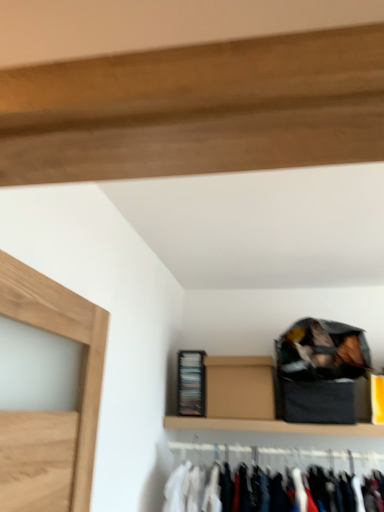
The height and width of the screenshot is (512, 384). In order to click on black plastic cabinet at lower center in this screenshot , I will do `click(191, 383)`.

What is the approximate width of black plastic cabinet at lower center?

It is 10.65 inches.

What do you see at coordinates (191, 383) in the screenshot?
I see `black plastic cabinet at lower center` at bounding box center [191, 383].

The width and height of the screenshot is (384, 512). Find the location of `brown cardboard box at upper center`. brown cardboard box at upper center is located at coordinates (239, 387).

The width and height of the screenshot is (384, 512). Describe the element at coordinates (239, 387) in the screenshot. I see `brown cardboard box at upper center` at that location.

Find the location of a particular element. black plastic cabinet at lower center is located at coordinates (191, 383).

Is brown cardboard box at upper center to the right of black plastic cabinet at lower center from the viewer's perspective?

Indeed, brown cardboard box at upper center is positioned on the right side of black plastic cabinet at lower center.

Looking at this image, is brown cardboard box at upper center positioned before black plastic cabinet at lower center?

Yes, brown cardboard box at upper center is in front of black plastic cabinet at lower center.

Between point (221, 358) and point (191, 358), which one is positioned in front?

Point (221, 358)

From the image's perspective, between brown cardboard box at upper center and black plastic cabinet at lower center, which one is located above?

From the image's view, brown cardboard box at upper center is above.

From a real-world perspective, which is physically below, brown cardboard box at upper center or black plastic cabinet at lower center?

In real-world perspective, brown cardboard box at upper center is lower.

Looking at this image, does brown cardboard box at upper center have a lesser width compared to black plastic cabinet at lower center?

In fact, brown cardboard box at upper center might be wider than black plastic cabinet at lower center.

Does brown cardboard box at upper center have a lesser height compared to black plastic cabinet at lower center?

Yes, brown cardboard box at upper center is shorter than black plastic cabinet at lower center.

In terms of size, does brown cardboard box at upper center appear bigger or smaller than black plastic cabinet at lower center?

Considering their sizes, brown cardboard box at upper center takes up more space than black plastic cabinet at lower center.

Does brown cardboard box at upper center contain black plastic cabinet at lower center?

Actually, black plastic cabinet at lower center is outside brown cardboard box at upper center.

Is brown cardboard box at upper center directly adjacent to black plastic cabinet at lower center?

brown cardboard box at upper center is not next to black plastic cabinet at lower center, and they're not touching.

Is brown cardboard box at upper center oriented towards black plastic cabinet at lower center?

No, brown cardboard box at upper center does not turn towards black plastic cabinet at lower center.

Locate an element on the screen. The height and width of the screenshot is (512, 384). cabinet located below the brown cardboard box at upper center (from the image's perspective) is located at coordinates (191, 383).

Does black plastic cabinet at lower center appear on the right side of brown cardboard box at upper center?

In fact, black plastic cabinet at lower center is to the left of brown cardboard box at upper center.

Is black plastic cabinet at lower center closer to the viewer compared to brown cardboard box at upper center?

No, black plastic cabinet at lower center is further to the viewer.

Does point (203, 379) come in front of point (206, 379)?

No, it is not.

From the image's perspective, is black plastic cabinet at lower center under brown cardboard box at upper center?

Yes.

From a real-world perspective, relative to brown cardboard box at upper center, is black plastic cabinet at lower center vertically above or below?

From a real-world perspective, black plastic cabinet at lower center is physically above brown cardboard box at upper center.

Is black plastic cabinet at lower center wider than brown cardboard box at upper center?

Incorrect, the width of black plastic cabinet at lower center does not surpass that of brown cardboard box at upper center.

Considering the sizes of objects black plastic cabinet at lower center and brown cardboard box at upper center in the image provided, who is taller, black plastic cabinet at lower center or brown cardboard box at upper center?

black plastic cabinet at lower center is taller.

Is black plastic cabinet at lower center bigger than brown cardboard box at upper center?

Actually, black plastic cabinet at lower center might be smaller than brown cardboard box at upper center.

Looking at this image, is black plastic cabinet at lower center inside the boundaries of brown cardboard box at upper center, or outside?

black plastic cabinet at lower center is spatially situated outside brown cardboard box at upper center.

Is black plastic cabinet at lower center beside brown cardboard box at upper center?

No, black plastic cabinet at lower center is not making contact with brown cardboard box at upper center.

Is black plastic cabinet at lower center facing away from brown cardboard box at upper center?

No, black plastic cabinet at lower center is not facing away from brown cardboard box at upper center.

Measure the distance from black plastic cabinet at lower center to brown cardboard box at upper center.

A distance of 14.87 centimeters exists between black plastic cabinet at lower center and brown cardboard box at upper center.

Identify the location of box that appears in front of the black plastic cabinet at lower center. This screenshot has width=384, height=512. (239, 387).

Find the location of `box on the right of black plastic cabinet at lower center`. box on the right of black plastic cabinet at lower center is located at coordinates (239, 387).

Image resolution: width=384 pixels, height=512 pixels. What are the coordinates of `cabinet behind the brown cardboard box at upper center` in the screenshot? It's located at (191, 383).